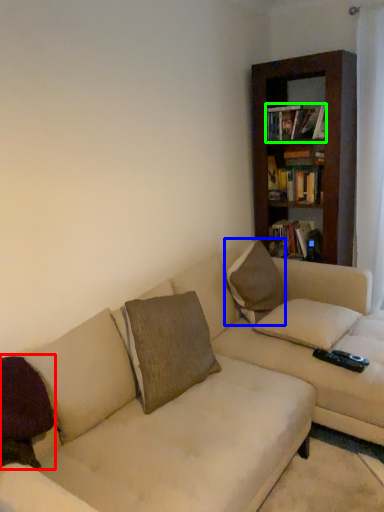
Question: Estimate the real-world distances between objects in this image. Which object is farther from pillow (highlighted by a red box), pillow (highlighted by a blue box) or book (highlighted by a green box)?

Choices:
 (A) pillow
 (B) book

Answer: (B)